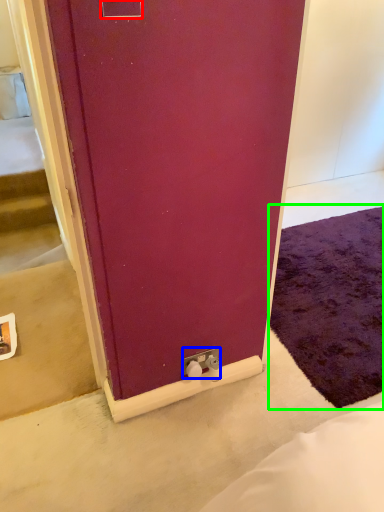
Question: Which object is positioned farthest from electric outlet (highlighted by a red box)? Select from electric outlet (highlighted by a blue box) and doormat (highlighted by a green box).

Choices:
 (A) electric outlet
 (B) doormat

Answer: (B)